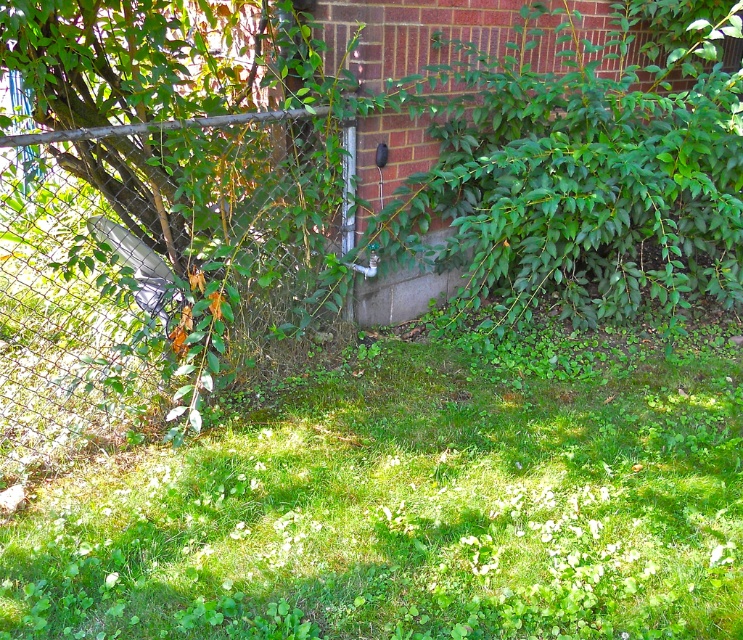
Is green grass at lower center further to camera compared to metallic chain-link fence at left?

No.

Between point (62, 586) and point (42, 362), which one is positioned behind?

The point (42, 362) is behind.

Which is in front, point (661, 358) or point (32, 208)?

Positioned in front is point (661, 358).

Identify the location of green grass at lower center. Image resolution: width=743 pixels, height=640 pixels. (406, 513).